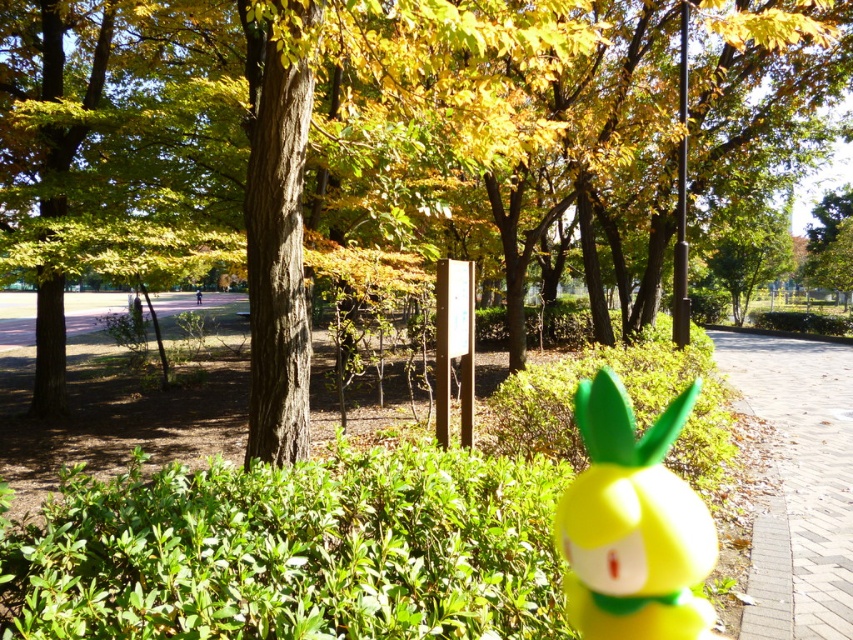
Question: Can you confirm if green matte tree at center is positioned to the right of yellow matte toy at center?

Choices:
 (A) no
 (B) yes

Answer: (A)

Question: Can you confirm if green matte tree at center is positioned below brick paved path at lower right?

Choices:
 (A) yes
 (B) no

Answer: (B)

Question: Which object is the closest to the brick paved path at lower right?

Choices:
 (A) green matte tree at center
 (B) yellow matte toy at center

Answer: (B)

Question: Which point is closer to the camera taking this photo?

Choices:
 (A) (630, 500)
 (B) (103, 22)
 (C) (827, 410)

Answer: (A)

Question: Is green matte tree at center above brick paved path at lower right?

Choices:
 (A) no
 (B) yes

Answer: (B)

Question: Among these points, which one is farthest from the camera?

Choices:
 (A) (567, 72)
 (B) (761, 522)
 (C) (640, 477)

Answer: (A)